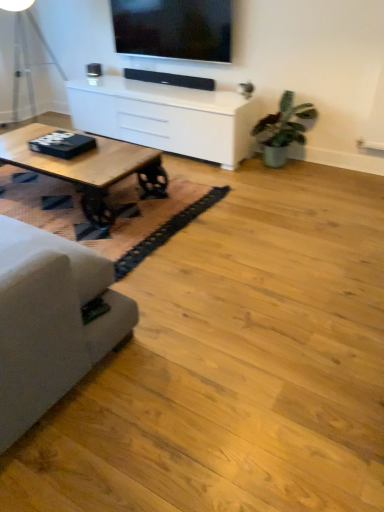
Find the location of `free spot above black woven mat at lower left (from a real-world perspective)`. free spot above black woven mat at lower left (from a real-world perspective) is located at coordinates (141, 215).